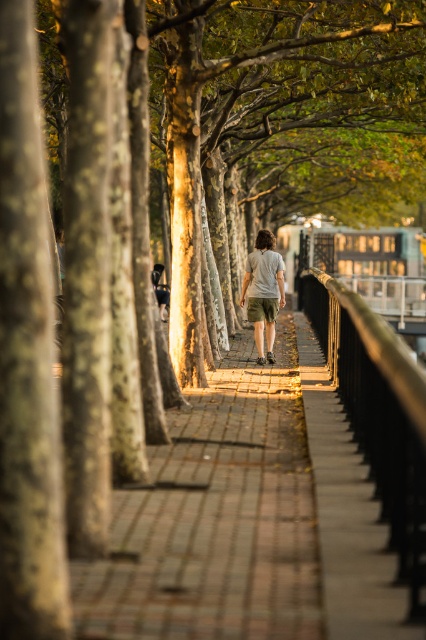
Describe the element at coordinates (215, 518) in the screenshot. This screenshot has height=640, width=426. I see `brick paved walkway at center` at that location.

Who is shorter, brick paved walkway at center or khaki shorts at center?

Standing shorter between the two is brick paved walkway at center.

Between point (209, 584) and point (256, 310), which one is positioned in front?

Point (209, 584)

In order to click on brick paved walkway at center in this screenshot , I will do `click(215, 518)`.

Who is lower down, brick paved walkway at center or metallic rail at right?

brick paved walkway at center

Is point (316, 529) closer to camera compared to point (368, 403)?

Yes, point (316, 529) is closer to viewer.

Is point (169, 413) less distant than point (356, 424)?

No.

Identify the location of brick paved walkway at center. Image resolution: width=426 pixels, height=640 pixels. (215, 518).

Between metallic rail at right and khaki shorts at center, which one appears on the left side from the viewer's perspective?

khaki shorts at center is more to the left.

Is metallic rail at right to the left of khaki shorts at center from the viewer's perspective?

No, metallic rail at right is not to the left of khaki shorts at center.

Is point (347, 348) farther from viewer compared to point (253, 269)?

No, it is not.

Where is `metallic rail at right`? The height and width of the screenshot is (640, 426). metallic rail at right is located at coordinates (377, 413).